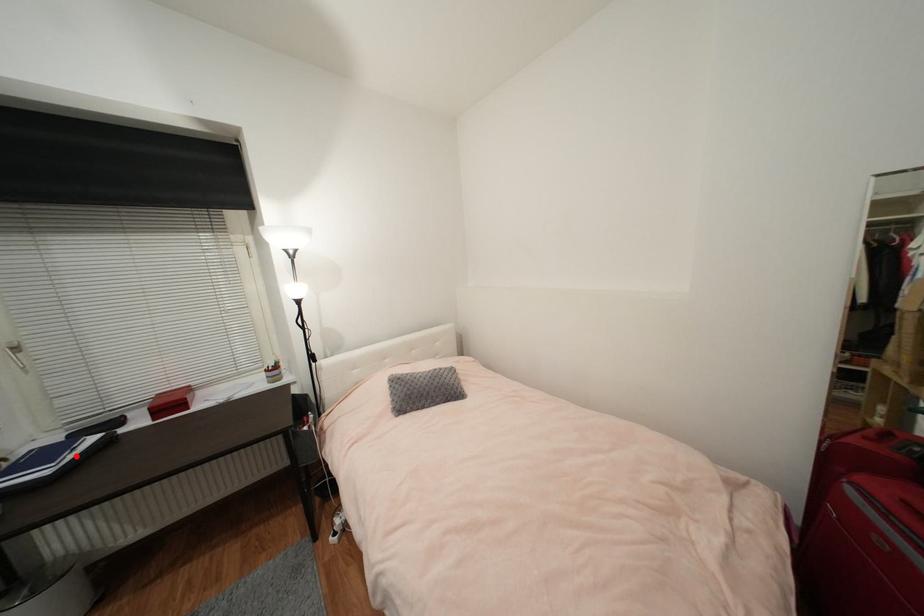
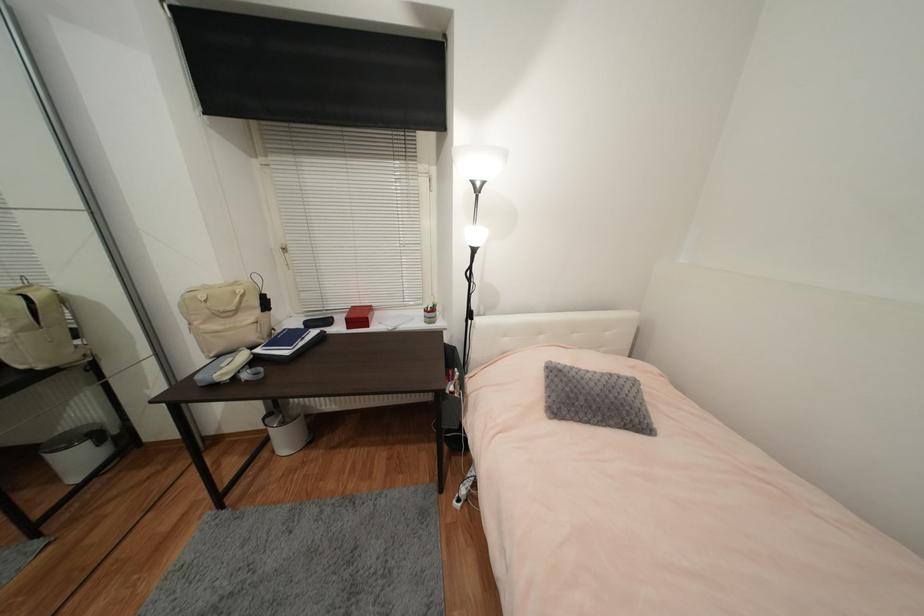
Question: I am providing you with two images of the same scene from different viewpoints. In image1, a red point is highlighted. Considering the same 3D point in image2, which of the following is correct?

Choices:
 (A) It is closer
 (B) It is farther

Answer: (A)